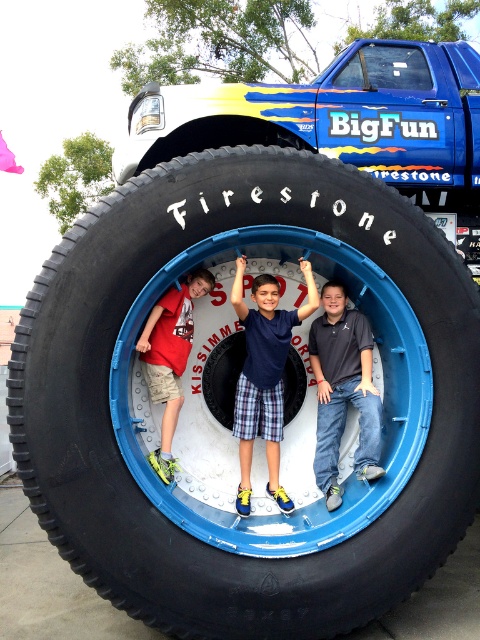
Does dark gray cotton shirt at center have a lesser width compared to blue plaid shorts at center?

Indeed, dark gray cotton shirt at center has a lesser width compared to blue plaid shorts at center.

Find the location of a particular element. The width and height of the screenshot is (480, 640). dark gray cotton shirt at center is located at coordinates (343, 388).

Is point (372, 426) more distant than point (263, 371)?

No, (372, 426) is closer to viewer.

Find the location of a particular element. The height and width of the screenshot is (640, 480). dark gray cotton shirt at center is located at coordinates (343, 388).

Which is above, dark gray cotton shirt at center or matte red shirt at center?

matte red shirt at center

Can you confirm if dark gray cotton shirt at center is positioned below matte red shirt at center?

Yes.

Where is `dark gray cotton shirt at center`? dark gray cotton shirt at center is located at coordinates (343, 388).

Identify the location of dark gray cotton shirt at center. (343, 388).

Is point (468, 72) closer to camera compared to point (249, 392)?

That is False.

Does point (182, 140) come farther from viewer compared to point (268, 291)?

Yes, it is behind point (268, 291).

Does point (163, 92) come behind point (256, 333)?

Yes, it is.

The image size is (480, 640). Identify the location of black rubber tire at center. (343, 122).